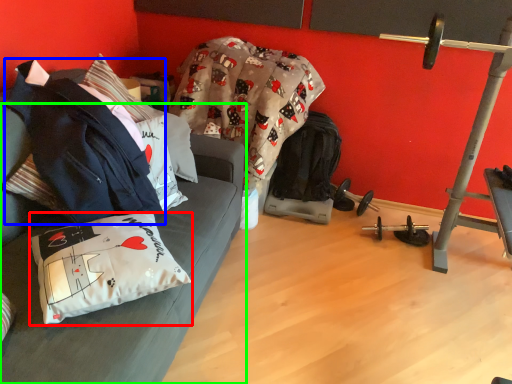
Question: Which is nearer to the pillow (highlighted by a red box)? jacket (highlighted by a blue box) or studio couch (highlighted by a green box).

Choices:
 (A) jacket
 (B) studio couch

Answer: (B)